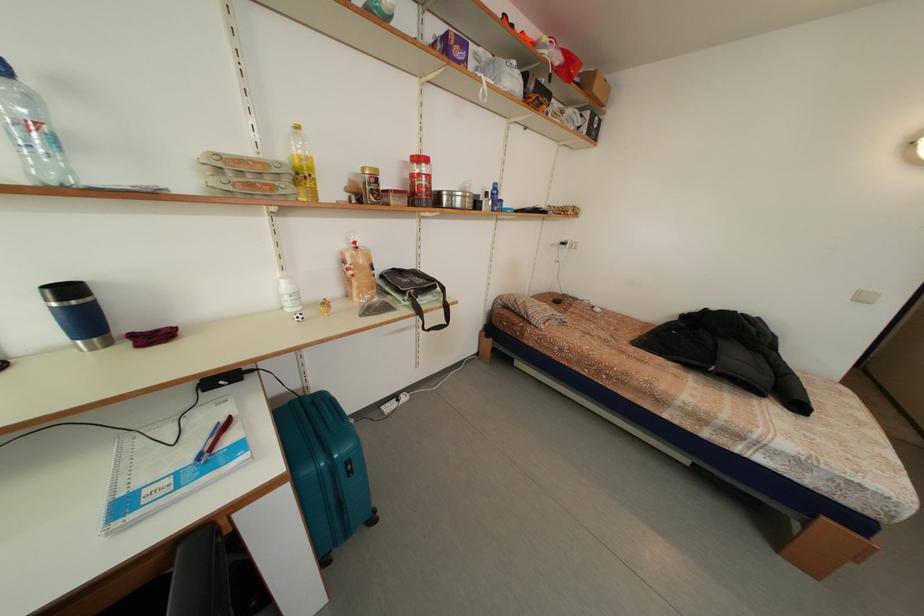
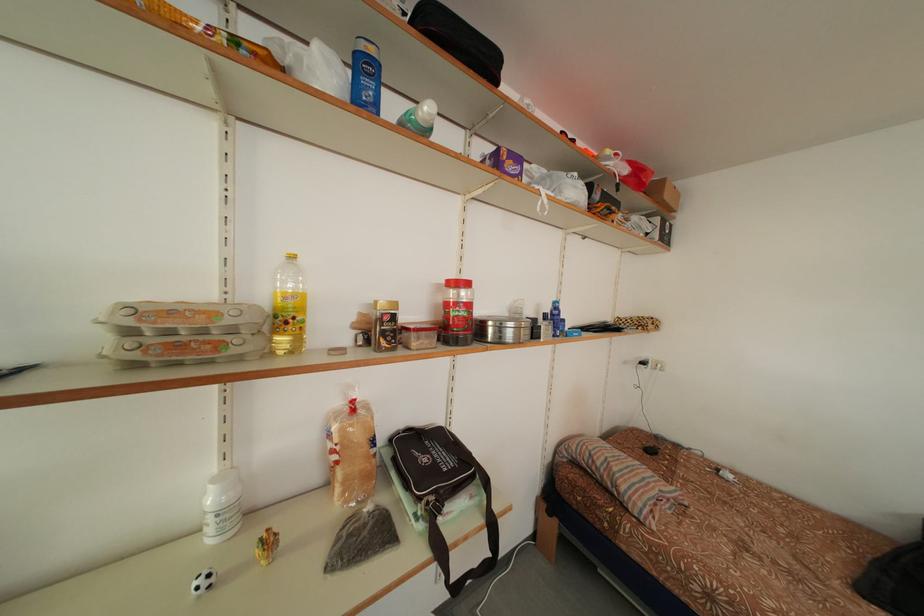
Where in the second image is the point corresponding to [417,164] from the first image?

(451, 288)